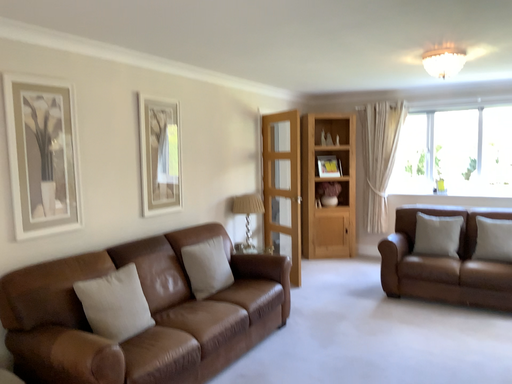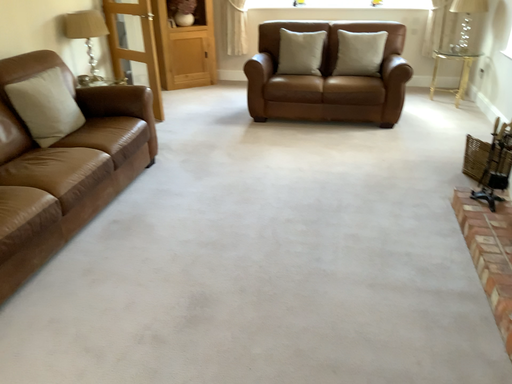
Question: Which way did the camera rotate in the video?

Choices:
 (A) rotated downward
 (B) rotated upward

Answer: (A)